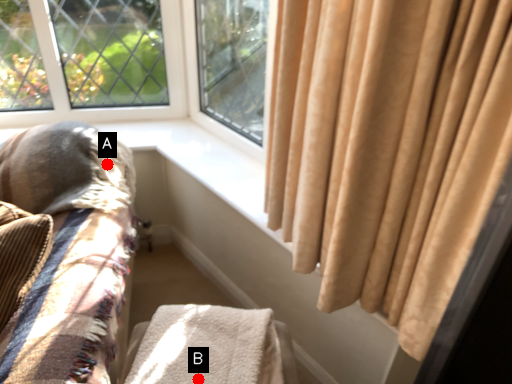
Question: Two points are circled on the image, labeled by A and B beside each circle. Which point appears closest to the camera in this image?

Choices:
 (A) A is closer
 (B) B is closer

Answer: (B)